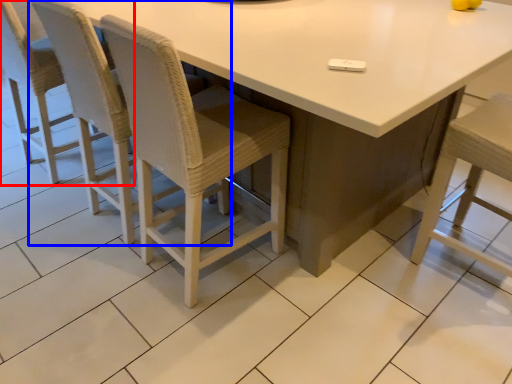
Question: Which point is further to the camera, chair (highlighted by a red box) or chair (highlighted by a blue box)?

Choices:
 (A) chair
 (B) chair

Answer: (A)